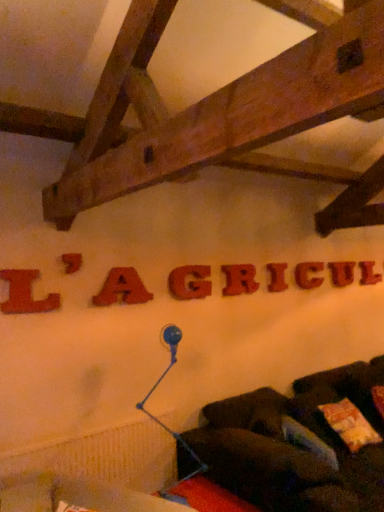
Question: From a real-world perspective, is rubberized red letter r at center, placed as the 5th letter when sorted from left to right, below matte red sign at center, which is counted as the 9th letter, starting from the front?

Choices:
 (A) no
 (B) yes

Answer: (A)

Question: Can you confirm if rubberized red letter r at center, placed as the 5th letter when sorted from left to right, is positioned to the right of matte red sign at center, which is counted as the 9th letter, starting from the front?

Choices:
 (A) yes
 (B) no

Answer: (B)

Question: Is rubberized red letter r at center, arranged as the 5th letter when viewed from the right, located outside matte red sign at center, which appears as the first letter when viewed from the right?

Choices:
 (A) no
 (B) yes

Answer: (B)

Question: Is rubberized red letter r at center, placed as the 5th letter when sorted from left to right, positioned before matte red sign at center, which appears as the first letter when viewed from the right?

Choices:
 (A) yes
 (B) no

Answer: (A)

Question: Is rubberized red letter r at center, placed as the 5th letter when sorted from left to right, oriented towards matte red sign at center, which is counted as the 9th letter, starting from the front?

Choices:
 (A) no
 (B) yes

Answer: (A)

Question: From the image's perspective, is rubberized red letter r at center, which ranks as the 5th letter in back-to-front order, below matte red sign at center, placed as the 1th letter when sorted from back to front?

Choices:
 (A) no
 (B) yes

Answer: (B)

Question: From the image's perspective, is matte red letter at center, which is the 7th letter in front-to-back order, beneath matte red letter at center, which is the sixth letter from left to right?

Choices:
 (A) yes
 (B) no

Answer: (B)

Question: Does matte red letter at center, which is the third letter from right to left, touch matte red letter at center, the 6th letter in the front-to-back sequence?

Choices:
 (A) no
 (B) yes

Answer: (A)

Question: Is matte red letter at center, which is the third letter from right to left, taller than matte red letter at center, acting as the 4th letter starting from the back?

Choices:
 (A) no
 (B) yes

Answer: (B)

Question: Is matte red letter at center, acting as the third letter starting from the back, facing towards matte red letter at center, which is the sixth letter from left to right?

Choices:
 (A) no
 (B) yes

Answer: (A)

Question: From a real-world perspective, is matte red letter at center, acting as the third letter starting from the back, located beneath matte red letter at center, which is the sixth letter from left to right?

Choices:
 (A) no
 (B) yes

Answer: (A)

Question: Can you confirm if matte red letter at center, which appears as the 7th letter when viewed from the left, is smaller than matte red letter at center, the 6th letter in the front-to-back sequence?

Choices:
 (A) yes
 (B) no

Answer: (B)

Question: Is blue glass lamp at lower center taller than rubberized red letter r at center, placed as the fifth letter when sorted from front to back?

Choices:
 (A) no
 (B) yes

Answer: (B)